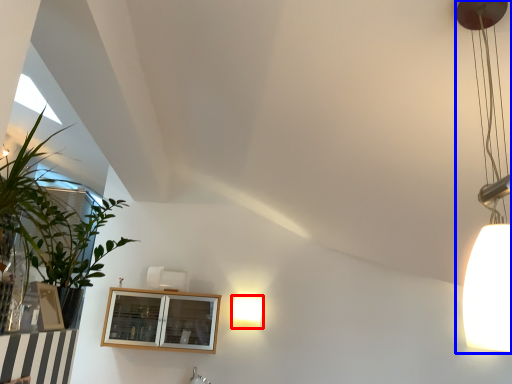
Question: Among these objects, which one is nearest to the camera, lamp (highlighted by a red box) or lamp (highlighted by a blue box)?

Choices:
 (A) lamp
 (B) lamp

Answer: (B)